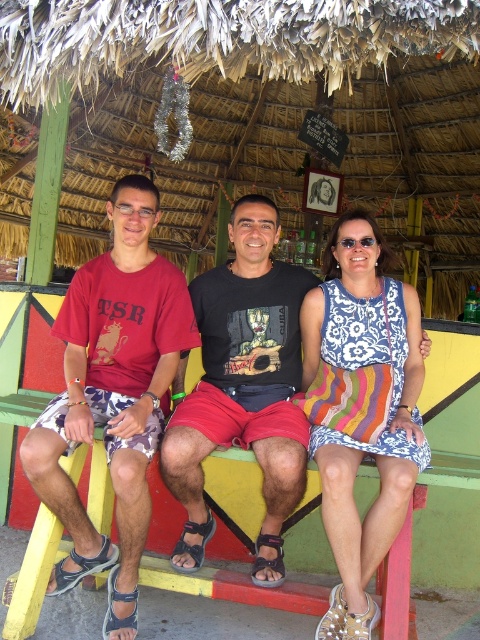
Can you confirm if floral-patterned fabric dress at center is taller than black cotton t-shirt at center?

Correct, floral-patterned fabric dress at center is much taller as black cotton t-shirt at center.

Is floral-patterned fabric dress at center to the left of black cotton t-shirt at center from the viewer's perspective?

In fact, floral-patterned fabric dress at center is to the right of black cotton t-shirt at center.

Does point (343, 611) lie behind point (240, 358)?

No, (343, 611) is closer to viewer.

At what (x,y) coordinates should I click in order to perform the action: click on floral-patterned fabric dress at center. Please return your answer as a coordinate pair (x, y). The image size is (480, 640). Looking at the image, I should click on pos(360,408).

What do you see at coordinates (112, 394) in the screenshot?
I see `matte red t-shirt at left` at bounding box center [112, 394].

Does point (94, 352) come closer to viewer compared to point (313, 296)?

Yes, point (94, 352) is closer to viewer.

Is point (131, 604) less distant than point (396, 499)?

No, it is not.

The width and height of the screenshot is (480, 640). Find the location of `matte red t-shirt at left`. matte red t-shirt at left is located at coordinates (112, 394).

Is matte red t-shirt at left above black cotton t-shirt at center?

No.

Which is above, matte red t-shirt at left or black cotton t-shirt at center?

Positioned higher is black cotton t-shirt at center.

Is point (101, 352) positioned after point (276, 492)?

Yes.

Where is `matte red t-shirt at left`? matte red t-shirt at left is located at coordinates (112, 394).